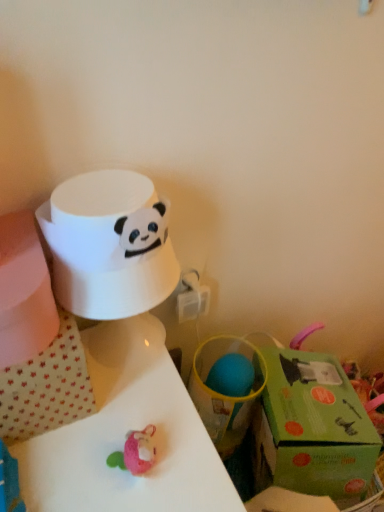
Find the location of a particular element. empty space that is ontop of white glossy table at center is located at coordinates (108, 417).